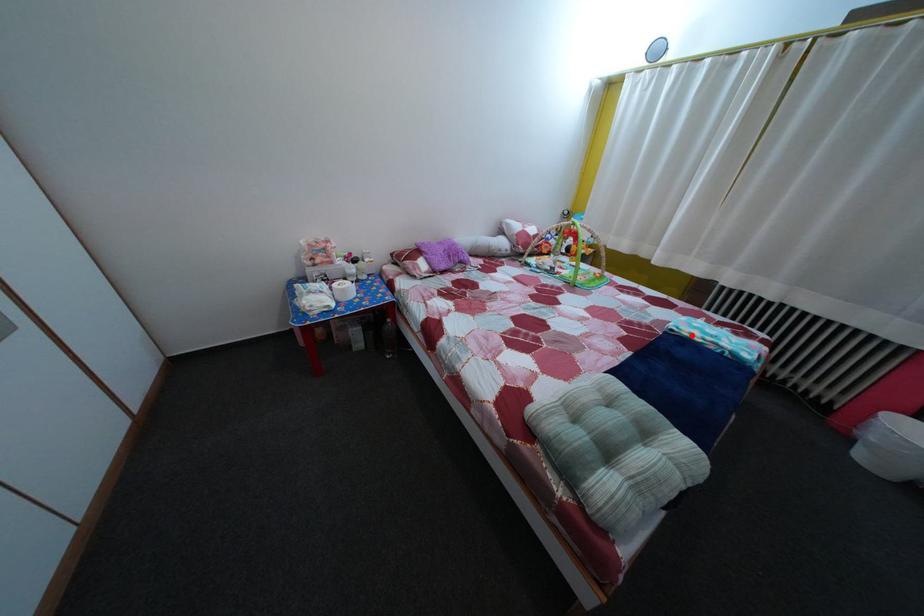
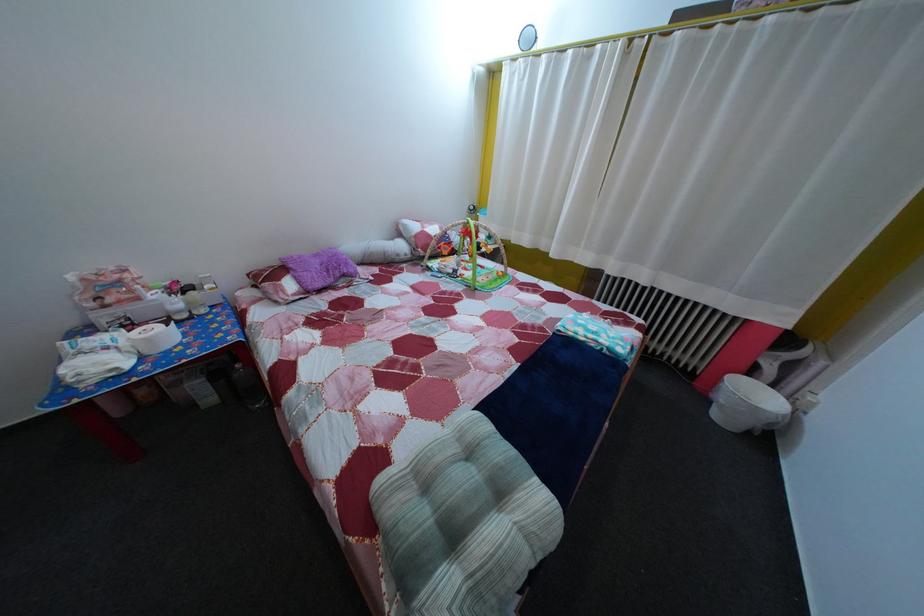
In the second image, find the point that corresponds to the highlighted location in the first image.

(578, 334)